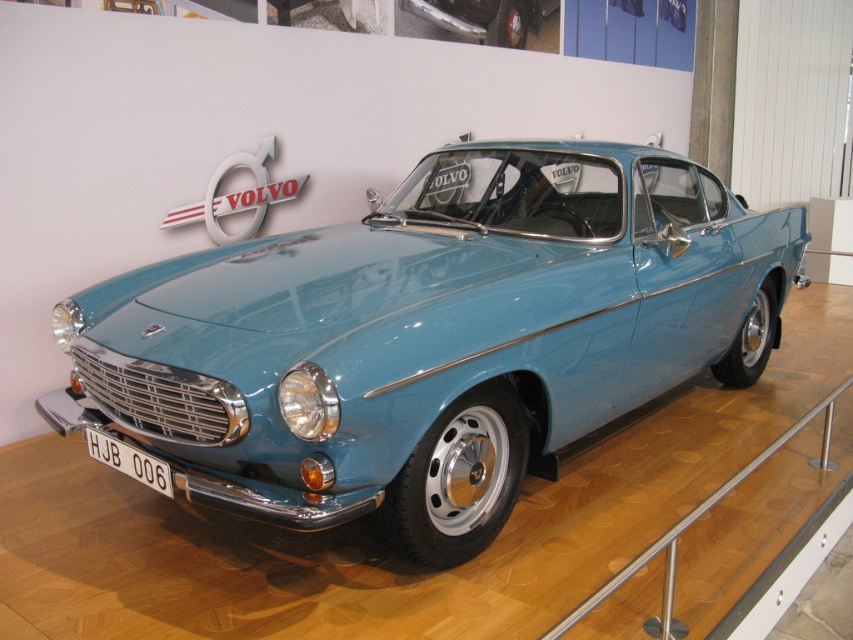
You are standing in front of the Volvo car and notice two points marked on the floor. The first point is at coordinates point (666, 634) and the second at point (457, 29). Which point is closer to the front of the car?

Point (666, 634) is in front of point (457, 29), so the first point is closer to the front of the car.